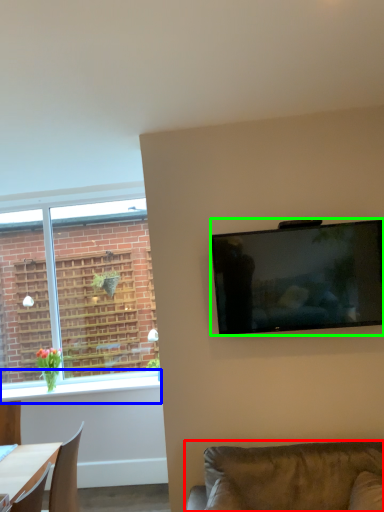
Question: Which is nearer to the studio couch (highlighted by a red box)? window sill (highlighted by a blue box) or television (highlighted by a green box).

Choices:
 (A) window sill
 (B) television

Answer: (B)